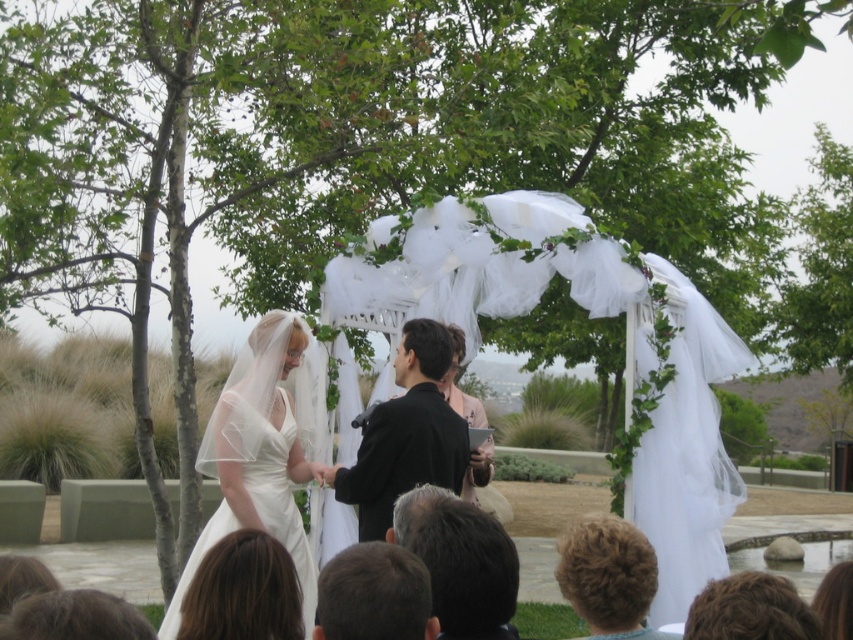
How distant is white satin dress at left from dark brown hair at center?

white satin dress at left is 11.98 feet from dark brown hair at center.

Which is below, white satin dress at left or dark brown hair at center?

dark brown hair at center

Is point (260, 452) behind point (357, 582)?

Yes, point (260, 452) is farther from viewer.

Identify the location of white satin dress at left. The width and height of the screenshot is (853, 640). coord(263,451).

Does white satin dress at left appear under gray hair at center?

No, white satin dress at left is not below gray hair at center.

Between white satin dress at left and gray hair at center, which one has less height?

With less height is gray hair at center.

This screenshot has width=853, height=640. Describe the element at coordinates (263, 451) in the screenshot. I see `white satin dress at left` at that location.

In order to click on white satin dress at left in this screenshot , I will do `click(263, 451)`.

Which of these two, white tulle canopy at center or black smooth suit at center, stands taller?

With more height is white tulle canopy at center.

Find the location of `white tulle canopy at center`. white tulle canopy at center is located at coordinates (482, 282).